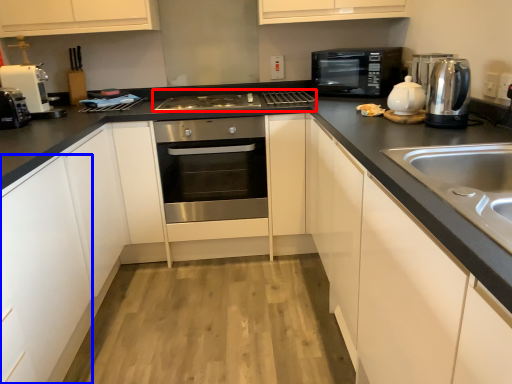
Question: Which point is further to the camera, gas stove (highlighted by a red box) or cabinetry (highlighted by a blue box)?

Choices:
 (A) gas stove
 (B) cabinetry

Answer: (A)